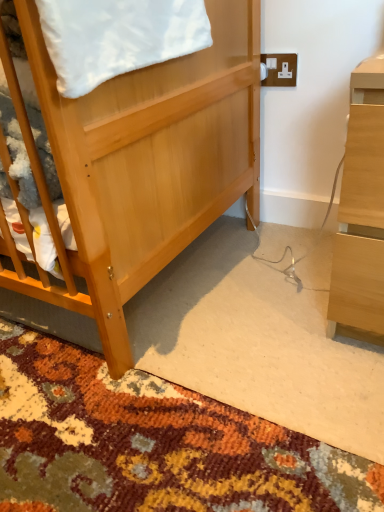
Question: From a real-world perspective, relative to white plastic electric outlet at upper right, is light wood desk at right vertically above or below?

Choices:
 (A) above
 (B) below

Answer: (B)

Question: Is light wood desk at right bigger or smaller than white plastic electric outlet at upper right?

Choices:
 (A) small
 (B) big

Answer: (B)

Question: Which of these objects is positioned farthest from the carpeted rug at center?

Choices:
 (A) light wood desk at right
 (B) white plastic electric outlet at upper right
 (C) white soft blanket at upper left
 (D) light brown wooden bed at center

Answer: (B)

Question: Based on their relative distances, which object is farther from the light wood desk at right?

Choices:
 (A) white plastic electric outlet at upper right
 (B) light brown wooden bed at center
 (C) white soft blanket at upper left
 (D) carpeted rug at center

Answer: (A)